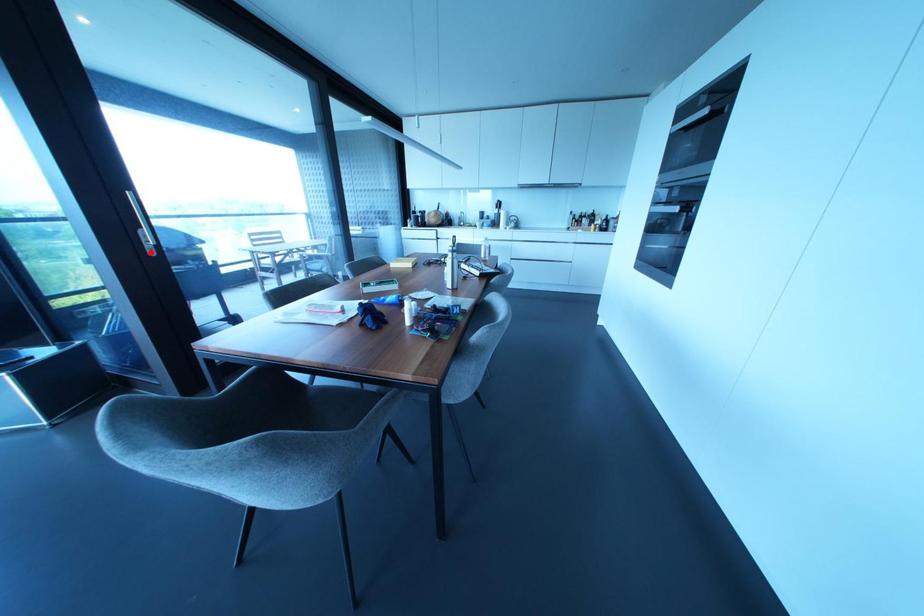
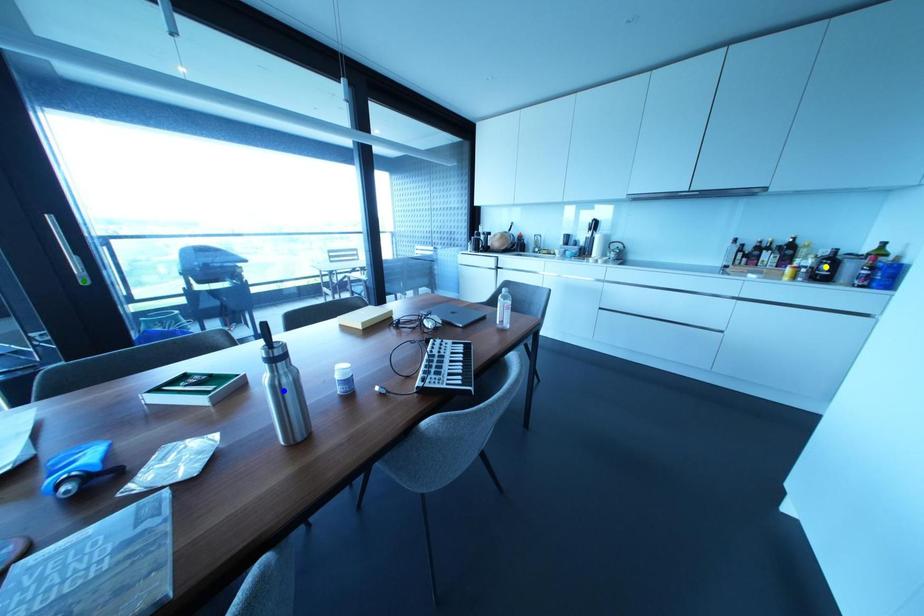
Question: I am providing you with two images of the same scene from different viewpoints. A red point is marked on the first image. You are given multiple points on the second image. In image 2, which mark is for the same physical point as the one in image 1?

Choices:
 (A) blue point
 (B) yellow point
 (C) green point

Answer: (C)